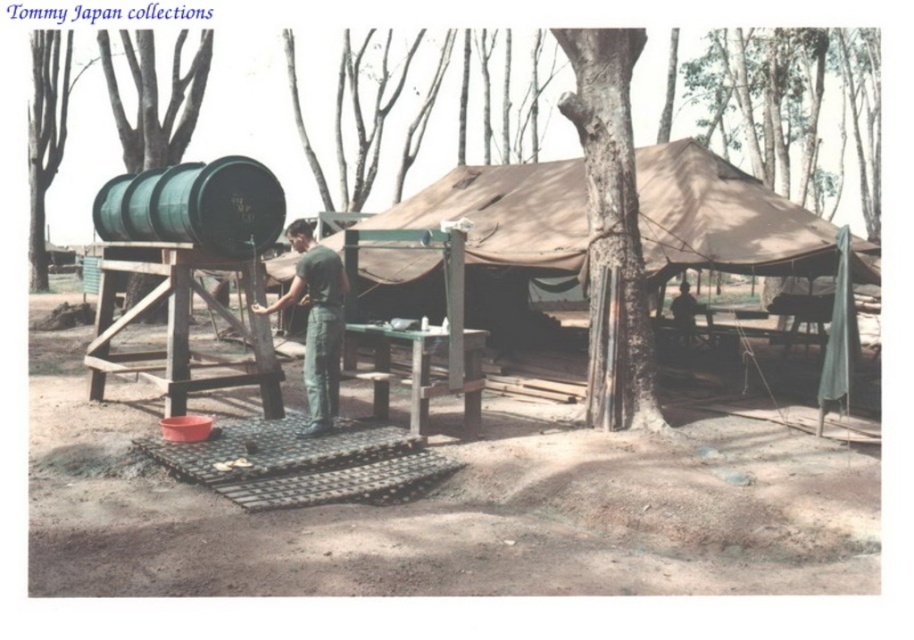
Between point (335, 339) and point (684, 342), which one is positioned behind?

The point (684, 342) is more distant.

Is green matte uniform at center positioned at the back of dark green uniform at center?

No, it is in front of dark green uniform at center.

Which is behind, point (271, 307) or point (675, 326)?

The point (675, 326) is more distant.

Where is `green matte uniform at center`? This screenshot has height=640, width=914. green matte uniform at center is located at coordinates (316, 321).

Is green bark tree at left in front of dark green uniform at center?

No.

Who is higher up, green bark tree at left or dark green uniform at center?

green bark tree at left is higher up.

Identify the location of green bark tree at left. (46, 134).

This screenshot has height=640, width=914. What do you see at coordinates (611, 218) in the screenshot? I see `smooth bark tree at center` at bounding box center [611, 218].

In the scene shown: Which of these two, smooth bark tree at center or green bark tree at left, stands taller?

With more height is green bark tree at left.

Identify the location of smooth bark tree at center. (611, 218).

Locate an element on the screen. smooth bark tree at center is located at coordinates (611, 218).